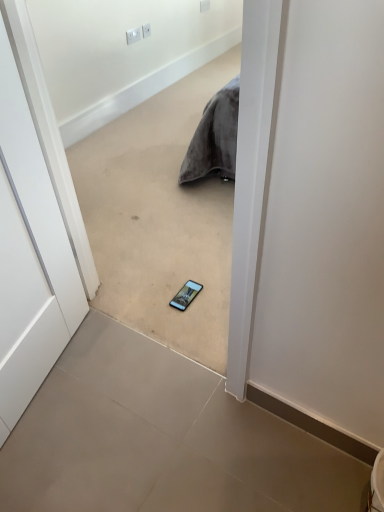
Question: Does gray tile floor at center, which is the 1th concrete in top-to-bottom order, appear on the left side of white plastic electric outlet at upper center, which is counted as the 3th electric outlet, starting from the front?

Choices:
 (A) yes
 (B) no

Answer: (A)

Question: Considering the relative positions of gray tile floor at center, placed as the second concrete when sorted from bottom to top, and white plastic electric outlet at upper center, which is the third electric outlet in bottom-to-top order, in the image provided, is gray tile floor at center, placed as the second concrete when sorted from bottom to top, to the right of white plastic electric outlet at upper center, which is the third electric outlet in bottom-to-top order, from the viewer's perspective?

Choices:
 (A) no
 (B) yes

Answer: (A)

Question: Is gray tile floor at center, which is the 1th concrete in top-to-bottom order, facing away from white plastic electric outlet at upper center, which is the first electric outlet in right-to-left order?

Choices:
 (A) yes
 (B) no

Answer: (B)

Question: Can you confirm if gray tile floor at center, placed as the second concrete when sorted from bottom to top, is taller than white plastic electric outlet at upper center, which ranks as the first electric outlet in top-to-bottom order?

Choices:
 (A) no
 (B) yes

Answer: (B)

Question: From the image's perspective, is gray tile floor at center, placed as the second concrete when sorted from bottom to top, located above white plastic electric outlet at upper center, the 3th electric outlet from the left?

Choices:
 (A) yes
 (B) no

Answer: (B)

Question: Would you say gray tile floor at center, placed as the second concrete when sorted from bottom to top, is outside white plastic electric outlet at upper center, which is the third electric outlet in bottom-to-top order?

Choices:
 (A) yes
 (B) no

Answer: (A)

Question: Is white plastic electric outlet at upper center, acting as the third electric outlet starting from the back, at the back of matte black smartphone at center?

Choices:
 (A) no
 (B) yes

Answer: (A)

Question: Is matte black smartphone at center shorter than white plastic electric outlet at upper center, which is the 3th electric outlet in right-to-left order?

Choices:
 (A) yes
 (B) no

Answer: (A)

Question: Is matte black smartphone at center at the left side of white plastic electric outlet at upper center, acting as the third electric outlet starting from the back?

Choices:
 (A) yes
 (B) no

Answer: (B)

Question: From a real-world perspective, is matte black smartphone at center over white plastic electric outlet at upper center, positioned as the 3th electric outlet in top-to-bottom order?

Choices:
 (A) yes
 (B) no

Answer: (B)

Question: Is white plastic electric outlet at upper center, positioned as the 3th electric outlet in top-to-bottom order, located within matte black smartphone at center?

Choices:
 (A) no
 (B) yes

Answer: (A)

Question: From a real-world perspective, is matte black smartphone at center below white plastic electric outlet at upper center, which is the 3th electric outlet in right-to-left order?

Choices:
 (A) no
 (B) yes

Answer: (B)

Question: Considering the relative sizes of white matte door at center and gray tile floor at center, placed as the second concrete when sorted from bottom to top, in the image provided, is white matte door at center bigger than gray tile floor at center, placed as the second concrete when sorted from bottom to top,?

Choices:
 (A) no
 (B) yes

Answer: (A)